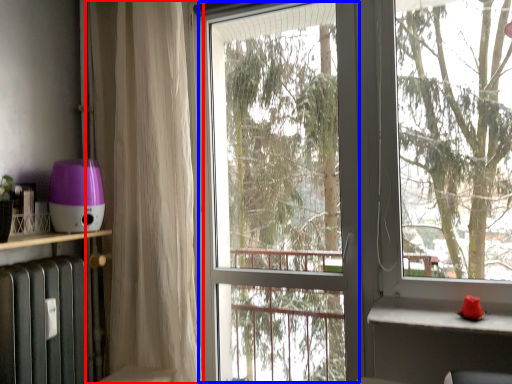
Question: Which of the following is the closest to the observer, curtain (highlighted by a red box) or screen door (highlighted by a blue box)?

Choices:
 (A) curtain
 (B) screen door

Answer: (B)